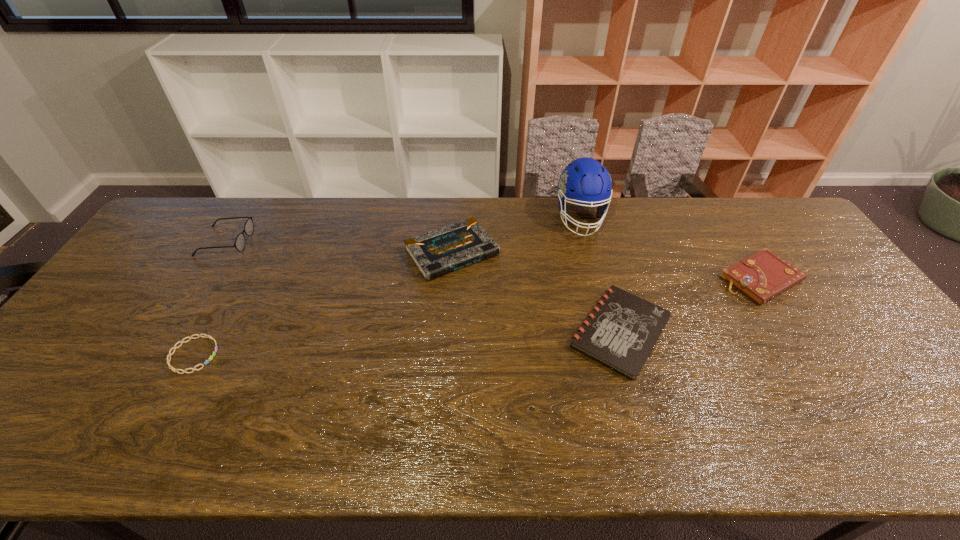
Image resolution: width=960 pixels, height=540 pixels. I want to click on football helmet, so click(585, 181).

Locate an element on the screen. Image resolution: width=960 pixels, height=540 pixels. spectacles is located at coordinates (239, 244).

Locate an element on the screen. This screenshot has width=960, height=540. the fourth object from right to left is located at coordinates (436, 253).

Locate an element on the screen. the rightmost notebook is located at coordinates (764, 275).

Identify the location of the shortest notebook. (621, 331).

Where is `the second shortest object`? This screenshot has width=960, height=540. the second shortest object is located at coordinates (621, 331).

At what (x,y) coordinates should I click in order to perform the action: click on the shortest object. Please return your answer as a coordinate pair (x, y). The width and height of the screenshot is (960, 540). Looking at the image, I should click on (210, 358).

Locate an element on the screen. The width and height of the screenshot is (960, 540). vacant space located 0.400m on the face guard of the tallest object is located at coordinates (612, 340).

You are a GUI agent. You are given a task and a screenshot of the screen. Output one action in this format:
    pyautogui.click(x=<x>, y=<y>)
    Task: Click on the free space located on the front-facing side of the spectacles
    Image resolution: width=960 pixels, height=540 pixels.
    Given the screenshot: What is the action you would take?
    click(276, 241)

Locate an element on the screen. vacant space situated on the right of the fourth object from right to left is located at coordinates (623, 252).